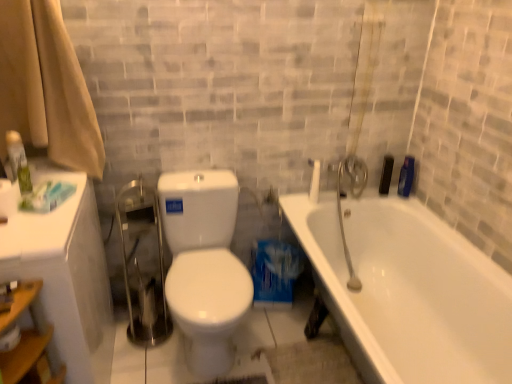
Question: From a real-world perspective, is white matte toilet paper at lower left located higher than beige fabric shower curtain at left?

Choices:
 (A) no
 (B) yes

Answer: (A)

Question: From the image's perspective, is white matte toilet paper at lower left below beige fabric shower curtain at left?

Choices:
 (A) no
 (B) yes

Answer: (B)

Question: Would you say beige fabric shower curtain at left is part of white matte toilet paper at lower left's contents?

Choices:
 (A) no
 (B) yes

Answer: (A)

Question: Considering the relative sizes of white matte toilet paper at lower left and beige fabric shower curtain at left in the image provided, is white matte toilet paper at lower left bigger than beige fabric shower curtain at left?

Choices:
 (A) yes
 (B) no

Answer: (B)

Question: From a real-world perspective, is white matte toilet paper at lower left under beige fabric shower curtain at left?

Choices:
 (A) yes
 (B) no

Answer: (A)

Question: Is white matte toilet paper at lower left facing away from beige fabric shower curtain at left?

Choices:
 (A) no
 (B) yes

Answer: (A)

Question: Would you say white matte toilet paper at lower left is outside white glossy toilet at center?

Choices:
 (A) no
 (B) yes

Answer: (B)

Question: Can you confirm if white matte toilet paper at lower left is thinner than white glossy toilet at center?

Choices:
 (A) no
 (B) yes

Answer: (B)

Question: From the image's perspective, is white matte toilet paper at lower left located beneath white glossy toilet at center?

Choices:
 (A) yes
 (B) no

Answer: (A)

Question: Is white matte toilet paper at lower left behind white glossy toilet at center?

Choices:
 (A) no
 (B) yes

Answer: (A)

Question: Can you confirm if white matte toilet paper at lower left is bigger than white glossy toilet at center?

Choices:
 (A) yes
 (B) no

Answer: (B)

Question: Can you confirm if white matte toilet paper at lower left is positioned to the right of white glossy toilet at center?

Choices:
 (A) no
 (B) yes

Answer: (A)

Question: Would you say white glossy bathtub at right is part of white matte toilet paper at lower left's contents?

Choices:
 (A) no
 (B) yes

Answer: (A)